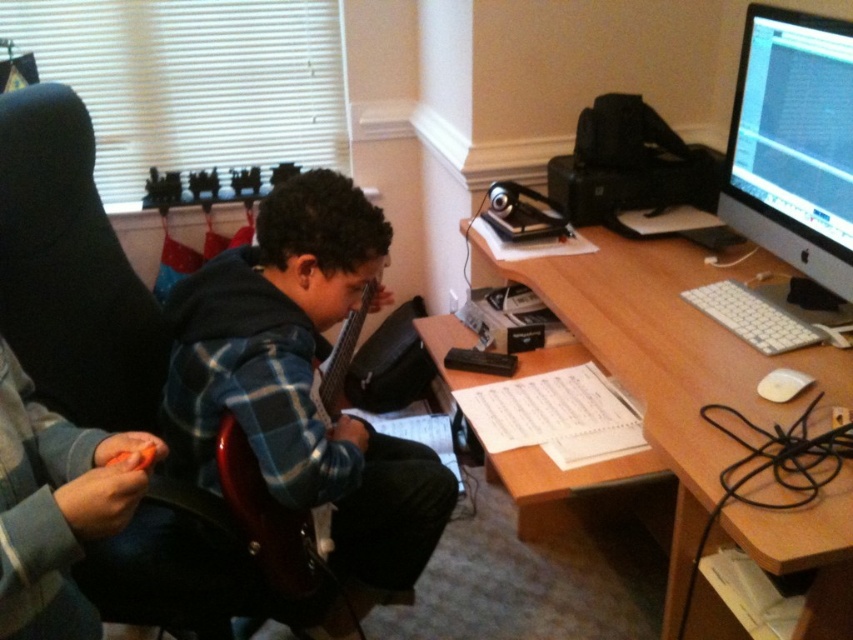
Who is more forward, (358, 304) or (59, 508)?

Point (59, 508) is more forward.

Who is more forward, (341, 234) or (57, 436)?

Point (57, 436) is in front.

Where is `wooden acoustic guitar at center`? The width and height of the screenshot is (853, 640). wooden acoustic guitar at center is located at coordinates (303, 381).

Is point (805, 195) positioned behind point (79, 440)?

Yes, point (805, 195) is farther from viewer.

Can you confirm if black glossy monitor at upper right is smaller than orange plastic toy at lower left?

Incorrect, black glossy monitor at upper right is not smaller in size than orange plastic toy at lower left.

The height and width of the screenshot is (640, 853). What do you see at coordinates (793, 144) in the screenshot? I see `black glossy monitor at upper right` at bounding box center [793, 144].

This screenshot has width=853, height=640. What are the coordinates of `black glossy monitor at upper right` in the screenshot? It's located at (793, 144).

Is point (682, 496) closer to viewer compared to point (3, 545)?

No.

Between point (688, 307) and point (73, 426), which one is positioned behind?

The point (688, 307) is more distant.

Locate an element on the screen. This screenshot has width=853, height=640. wooden at upper right is located at coordinates (660, 362).

The height and width of the screenshot is (640, 853). In order to click on wooden at upper right in this screenshot , I will do `click(660, 362)`.